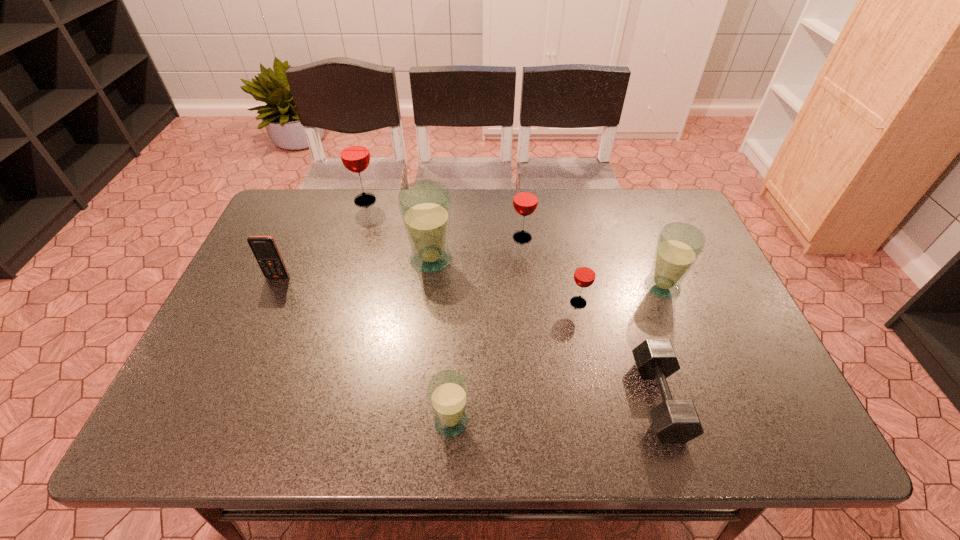
You are a GUI agent. You are given a task and a screenshot of the screen. Output one action in this format:
    pyautogui.click(x=<x>, y=<y>)
    Task: Click on the object identified as the closest to the dumbbell
    
    Given the screenshot: What is the action you would take?
    pyautogui.click(x=584, y=276)

I want to click on object that is the fifth closest to the rightmost object, so click(448, 391).

Identify the location of glass that can be found as the second closest to the shortest object. (679, 245).

Find the location of a particular element. glass that is the closest one to the leftmost glass is located at coordinates (425, 205).

Identify which red glass is located as the nearest to the biggest blue glass. Please provide its 2D coordinates. Your answer should be formatted as a tuple, i.e. [(x, y)], where the tuple contains the x and y coordinates of a point satisfying the conditions above.

[(525, 200)]

At what (x,y) coordinates should I click in order to perform the action: click on red glass that is the closest to the orange cellular telephone. Please return your answer as a coordinate pair (x, y). This screenshot has width=960, height=540. Looking at the image, I should click on (354, 152).

At what (x,y) coordinates should I click in order to perform the action: click on the third closest blue glass to the second object from right to left. Please return your answer as a coordinate pair (x, y). This screenshot has height=540, width=960. Looking at the image, I should click on (425, 205).

I want to click on blue glass that is the second closest one to the biggest blue glass, so click(679, 245).

What are the coordinates of `vacant point that satisfies the following two spatial constraints: 1. on the screen of the shortest object; 2. on the left side of the orange cellular telephone` in the screenshot? It's located at (224, 400).

Locate an element on the screen. free spot that satisfies the following two spatial constraints: 1. on the screen of the leftmost object; 2. on the left side of the shortest object is located at coordinates (224, 400).